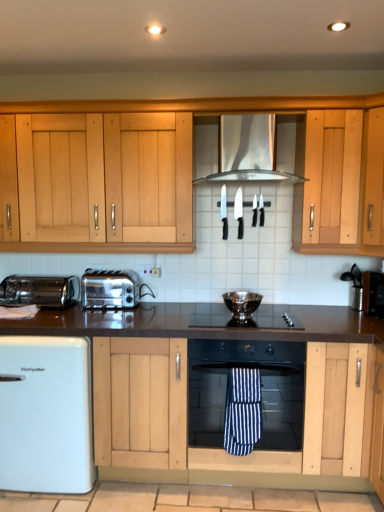
Question: Looking at their shapes, would you say silver metallic vent at center is wider or thinner than black glass gas stove at center?

Choices:
 (A) wide
 (B) thin

Answer: (B)

Question: In terms of size, does silver metallic vent at center appear bigger or smaller than black glass gas stove at center?

Choices:
 (A) big
 (B) small

Answer: (A)

Question: Which is nearer to the black plastic knife at center, the third appliance in the left-to-right sequence?

Choices:
 (A) silver metallic vent at center
 (B) black glass oven at center
 (C) black and white striped towel at center
 (D) metallic silver toaster at left
 (E) black plastic knives at center, which is the 1th appliance in left-to-right order

Answer: (E)

Question: Which of these objects is positioned closest to the black plastic knife at center, the fifth appliance in the right-to-left sequence?

Choices:
 (A) black glass oven at center
 (B) white glossy mini fridge at lower left
 (C) black plastic knives at center, the 5th appliance positioned from the left
 (D) black granite countertop at center
 (E) black plastic knife at center, the fourth appliance positioned from the left

Answer: (E)